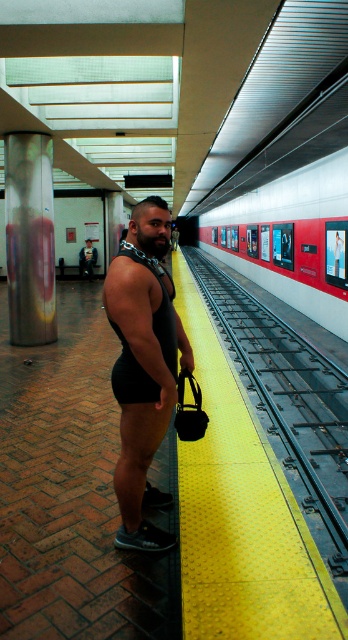
Question: Does smooth glossy train at center lie behind matte black singlet at center?

Choices:
 (A) no
 (B) yes

Answer: (A)

Question: Estimate the real-world distances between objects in this image. Which object is closer to the matte black singlet at center?

Choices:
 (A) metallic cylindrical pillar at left
 (B) smooth glossy train at center
 (C) black matte singlet at center

Answer: (B)

Question: Among these points, which one is farthest from the camera?

Choices:
 (A) (161, 234)
 (B) (238, 216)
 (C) (83, 262)

Answer: (B)

Question: Which of the following is the closest to the observer?

Choices:
 (A) black matte singlet at center
 (B) smooth glossy train at center
 (C) metallic cylindrical pillar at left

Answer: (A)

Question: Does smooth glossy train at center lie in front of matte black singlet at center?

Choices:
 (A) yes
 (B) no

Answer: (A)

Question: Is black matte singlet at center below metallic cylindrical pillar at left?

Choices:
 (A) yes
 (B) no

Answer: (A)